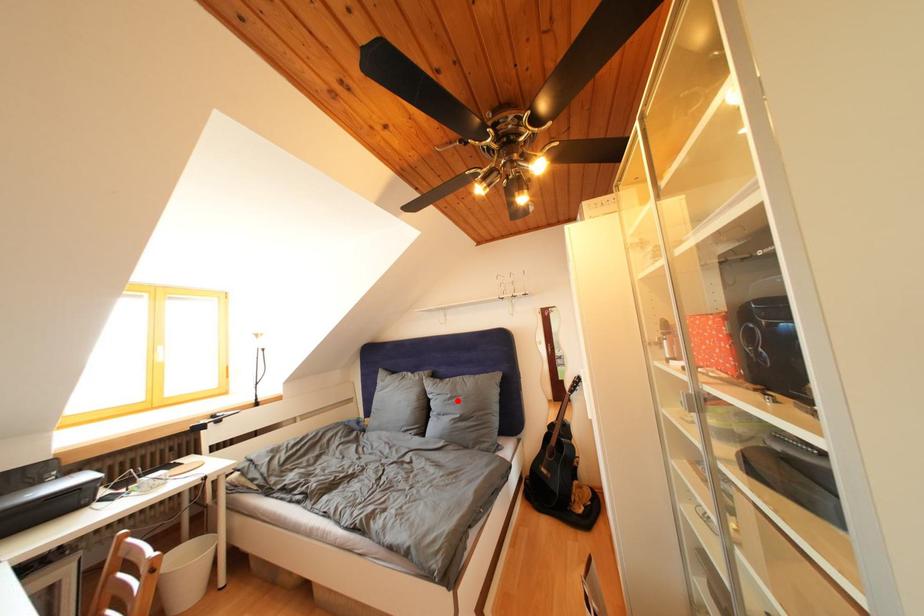
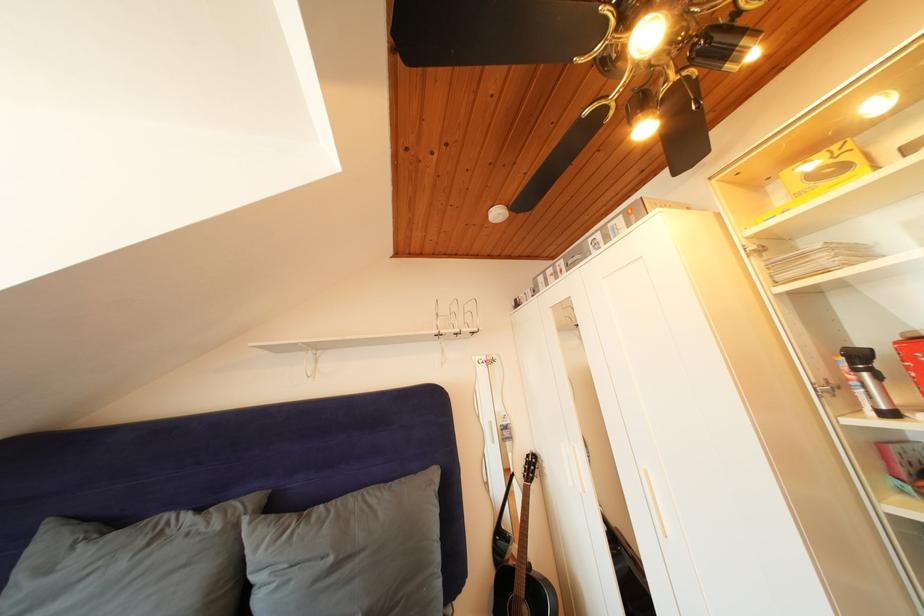
Question: I am providing you with two images of the same scene from different viewpoints. A red point is marked on the first image. Is the red point's position out of view in image 2?

Choices:
 (A) Yes
 (B) No

Answer: (B)